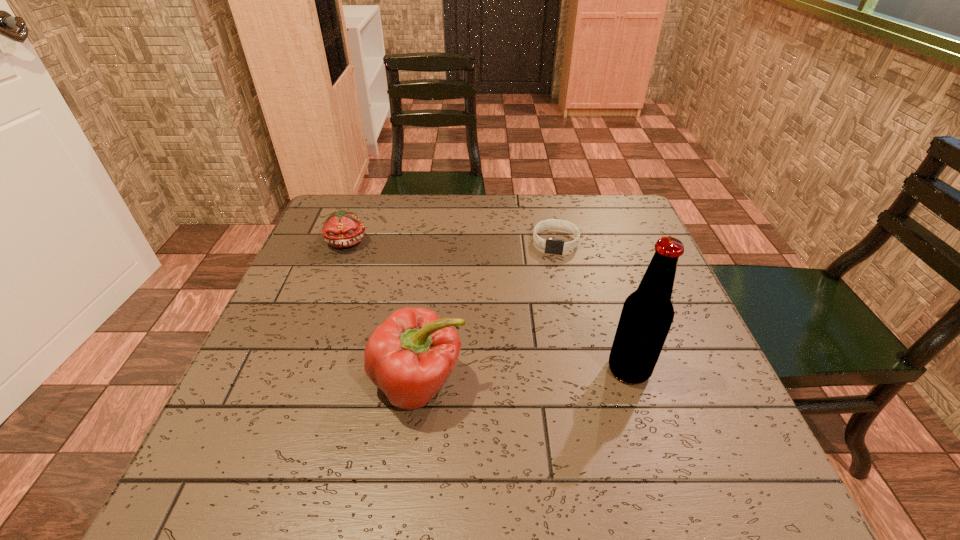
Identify the location of free space on the desktop that is between the third object from right to left and the tallest object and is positioned on the front-facing side of the third tallest object. (x=500, y=378).

The height and width of the screenshot is (540, 960). Find the location of `vacant space on the desktop that is between the second tallest object and the tallest object and is positioned on the outer surface of the shortest object`. vacant space on the desktop that is between the second tallest object and the tallest object and is positioned on the outer surface of the shortest object is located at coordinates (540, 375).